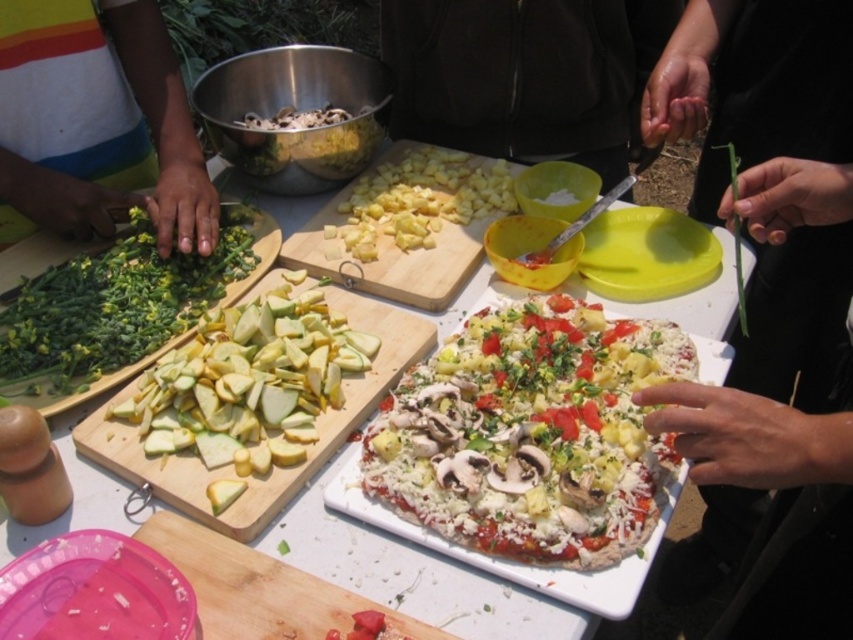
You are a chef organizing ingredients for a pizza night. You have the green leafy vegetable at upper right and the green leafy vegetables at left. Which one is placed underneath the other?

The green leafy vegetable at upper right is positioned under the green leafy vegetables at left.

You are a chef trying to reach both the green leafy vegetable at upper right and the green leafy vegetables at left from your current position. Which one is farther away from you?

The green leafy vegetable at upper right is 33.99 inches away from the green leafy vegetables at left, so the green leafy vegetable at upper right is farther away from you.